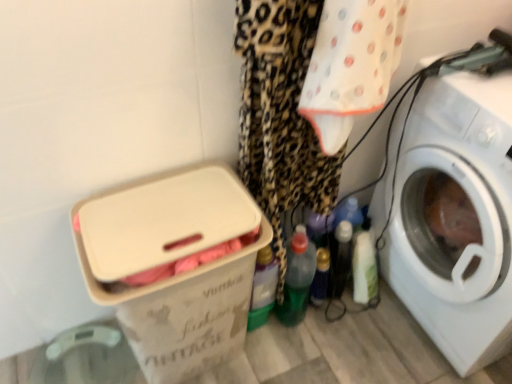
Image resolution: width=512 pixels, height=384 pixels. In order to click on free point to the right of translucent plastic bottle at center, which is the 1th bottle in right-to-left order in this screenshot , I will do `click(375, 318)`.